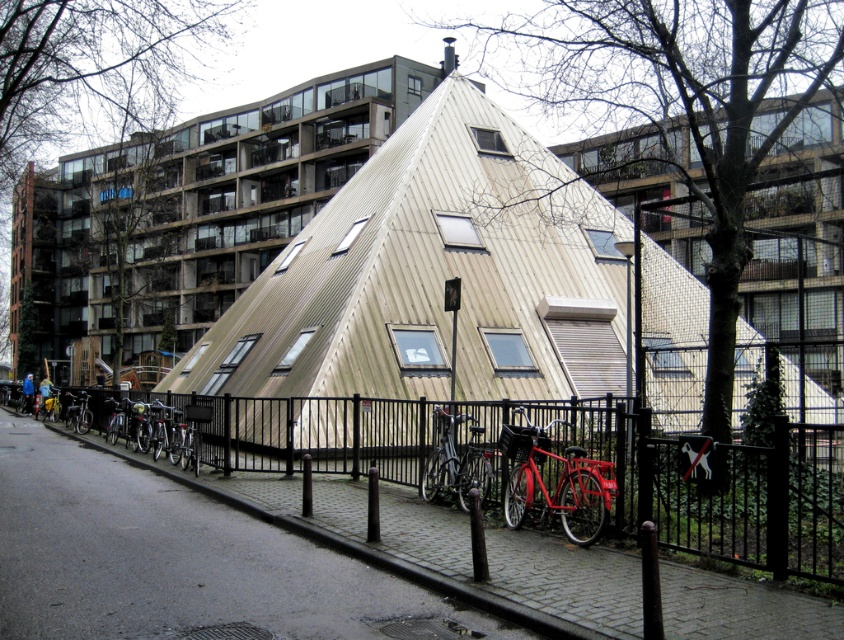
From the picture: Does black metal fence at center lie behind black matte bicycle at lower left?

No, it is in front of black matte bicycle at lower left.

Does black metal fence at center appear on the right side of black matte bicycle at lower left?

In fact, black metal fence at center is to the left of black matte bicycle at lower left.

Who is more forward, (766, 470) or (165, 428)?

Point (766, 470) is in front.

Locate an element on the screen. The image size is (844, 640). black metal fence at center is located at coordinates (720, 490).

Is shiny red bicycle at center behind shiny metallic bicycle at center?

No, shiny red bicycle at center is closer to the viewer.

Which of these two, shiny red bicycle at center or shiny metallic bicycle at center, stands shorter?

shiny red bicycle at center

Who is more distant from viewer, (593, 461) or (452, 444)?

Point (452, 444)

Find the location of a particular element. The image size is (844, 640). shiny red bicycle at center is located at coordinates (556, 483).

Does black matte bicycle at lower left appear over shiny metallic bicycle at center?

No.

Which of these two, black matte bicycle at lower left or shiny metallic bicycle at center, stands shorter?

With less height is shiny metallic bicycle at center.

Measure the distance between point [165,413] and camera.

They are 16.76 meters apart.

This screenshot has width=844, height=640. Identify the location of black matte bicycle at lower left. (142, 424).